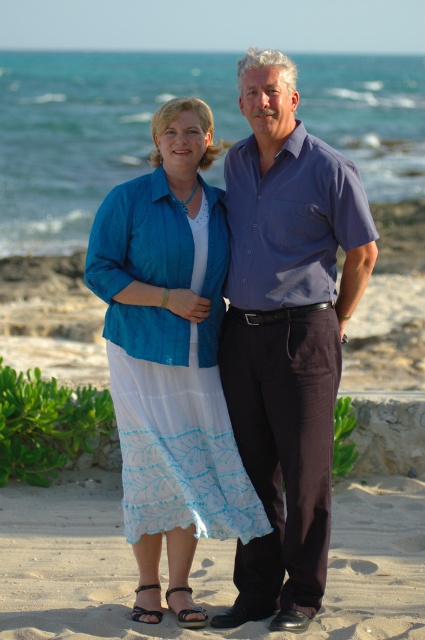
Question: Is matte blue blouse at center to the right of sandy at lower center from the viewer's perspective?

Choices:
 (A) no
 (B) yes

Answer: (A)

Question: Is purple cotton shirt at center smaller than sandy at lower center?

Choices:
 (A) no
 (B) yes

Answer: (B)

Question: Which is farther from the matte blue blouse at center?

Choices:
 (A) sandy at lower center
 (B) purple cotton shirt at center

Answer: (A)

Question: Which of the following is the closest to the observer?

Choices:
 (A) purple cotton shirt at center
 (B) sandy at lower center

Answer: (B)

Question: Among these objects, which one is nearest to the camera?

Choices:
 (A) matte blue blouse at center
 (B) purple cotton shirt at center
 (C) sandy at lower center

Answer: (C)

Question: Does purple cotton shirt at center come behind sandy at lower center?

Choices:
 (A) yes
 (B) no

Answer: (A)